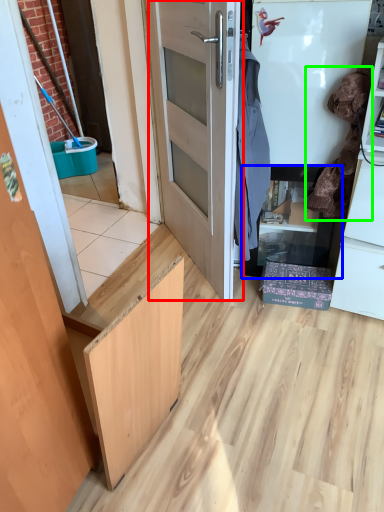
Question: Which object is the farthest from door (highlighted by a red box)? Choose among these: cabinetry (highlighted by a blue box) or laundry (highlighted by a green box).

Choices:
 (A) cabinetry
 (B) laundry

Answer: (B)